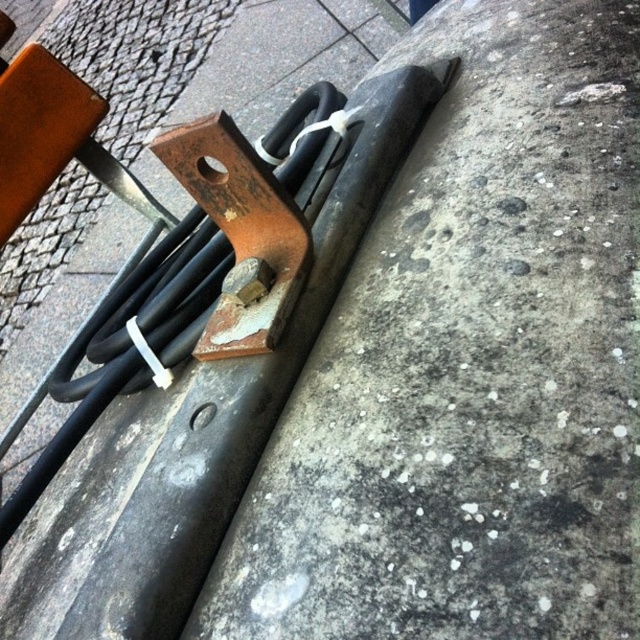
Who is lower down, gray concrete at center or rusty metal curb at center?

rusty metal curb at center is below.

Describe the element at coordinates (468, 365) in the screenshot. I see `gray concrete at center` at that location.

Which is behind, point (422, 262) or point (248, 195)?

Point (248, 195)

Find the location of a particular element. gray concrete at center is located at coordinates (468, 365).